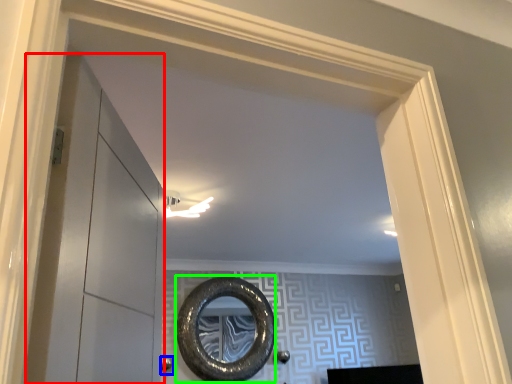
Question: Estimate the real-world distances between objects in this image. Which object is closer to glass door (highlighted by a red box), door handle (highlighted by a blue box) or oval (highlighted by a green box)?

Choices:
 (A) door handle
 (B) oval

Answer: (B)